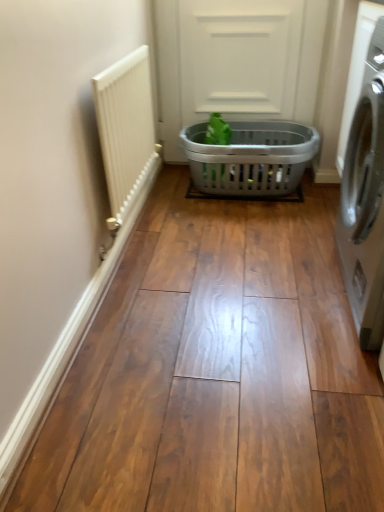
I want to click on vacant area on the back side of satin silver washing machine at right, so (x=285, y=232).